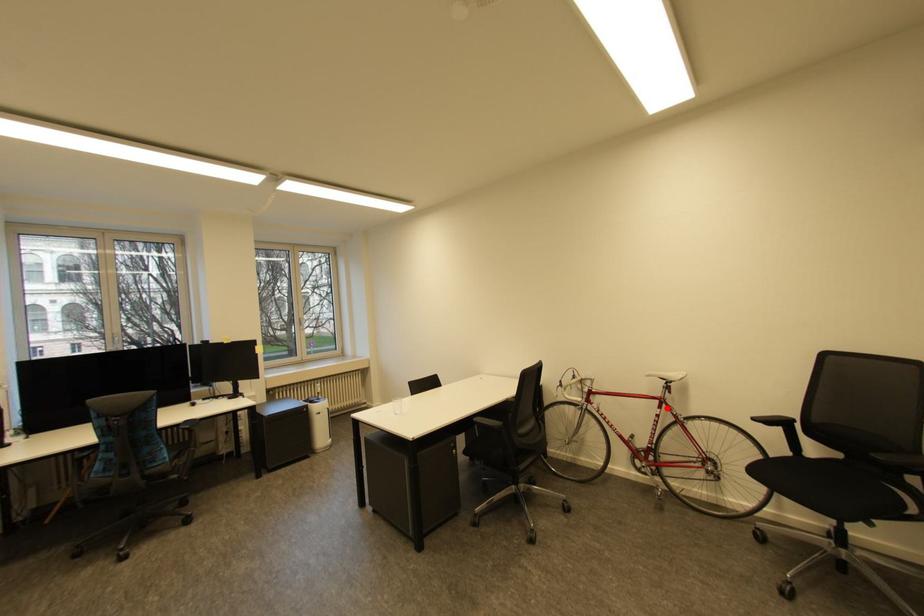
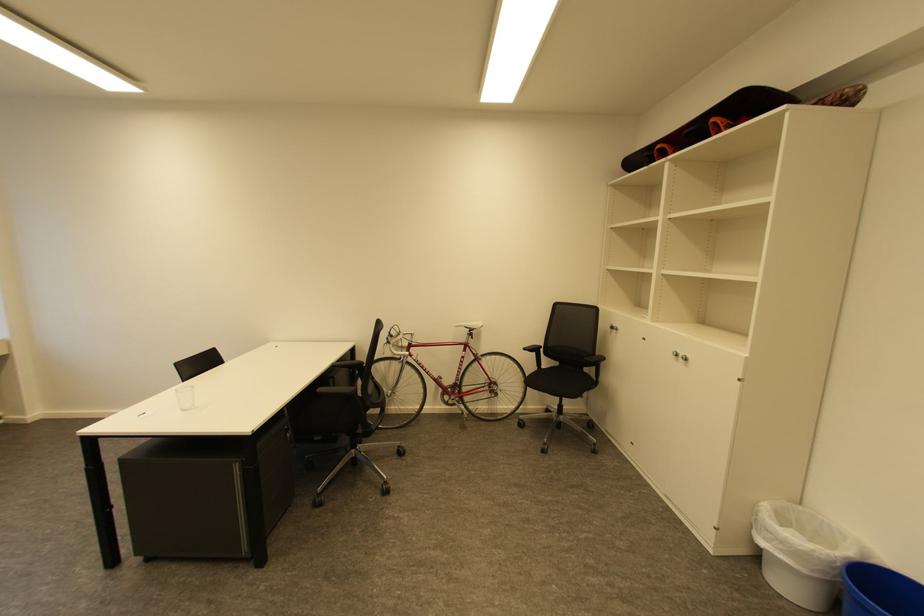
Where in the second image is the point corresponding to the highlighted location from the first image?

(471, 351)